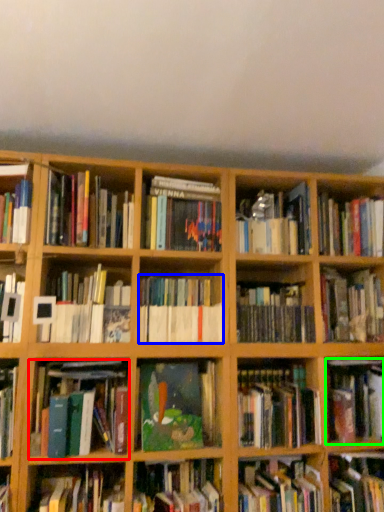
Question: Which object is positioned closest to book (highlighted by a red box)? Select from book (highlighted by a blue box) and book (highlighted by a green box).

Choices:
 (A) book
 (B) book

Answer: (A)